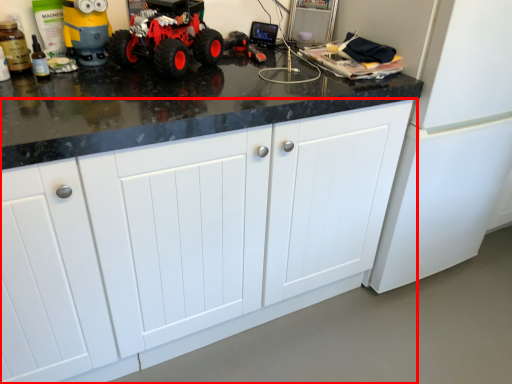
Question: From the image, what is the correct spatial relationship of cabinetry (annotated by the red box) in relation to land vehicle?

Choices:
 (A) left
 (B) right

Answer: (B)